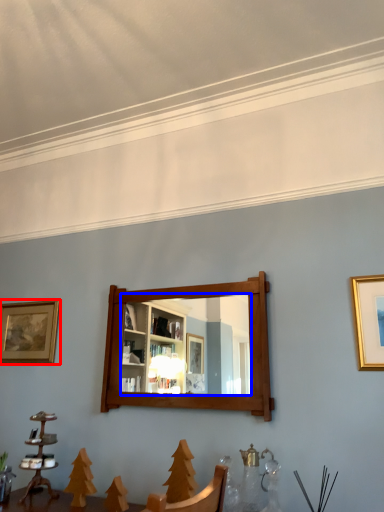
Question: Which point is further to the camera, picture frame (highlighted by a red box) or mirror (highlighted by a blue box)?

Choices:
 (A) picture frame
 (B) mirror

Answer: (A)